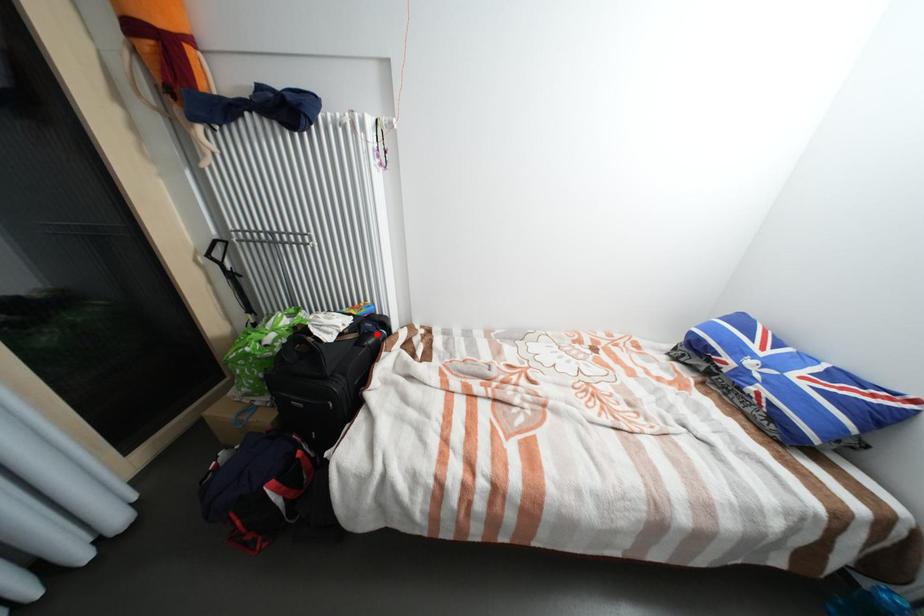
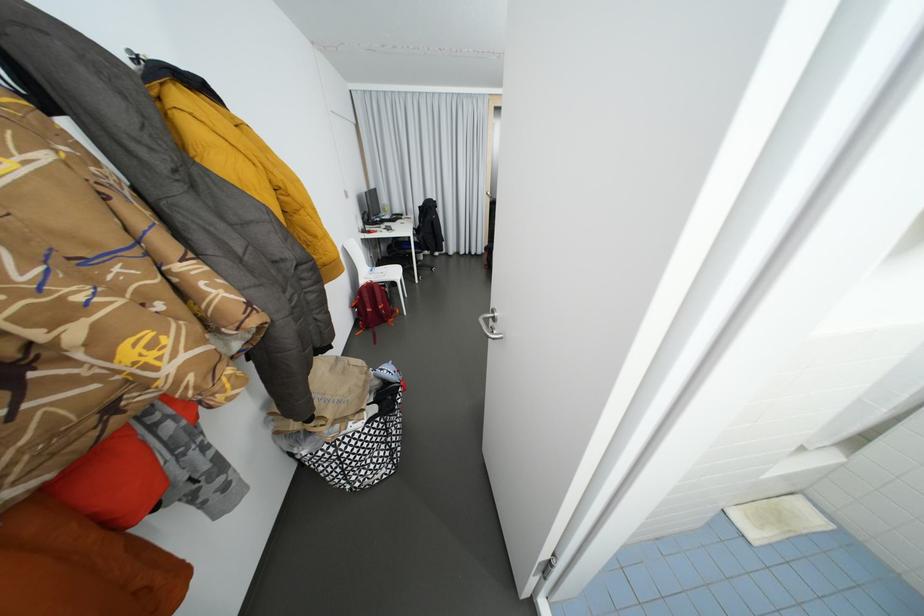
Question: I am providing you with two images of the same scene from different viewpoints. A red point is marked on the first image. Is the red point's position out of view in image 2?

Choices:
 (A) Yes
 (B) No

Answer: (A)